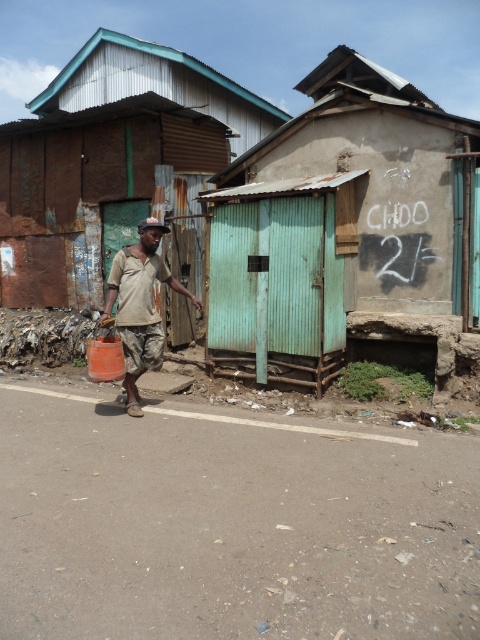
You are a delivery person trying to navigate through the urban street scene. You see the rusty corrugated metal hut at center and the camouflage pants at center. Which object is closer to you?

The camouflage pants at center are closer to you because the rusty corrugated metal hut at center is positioned over them, meaning the hut is farther away.